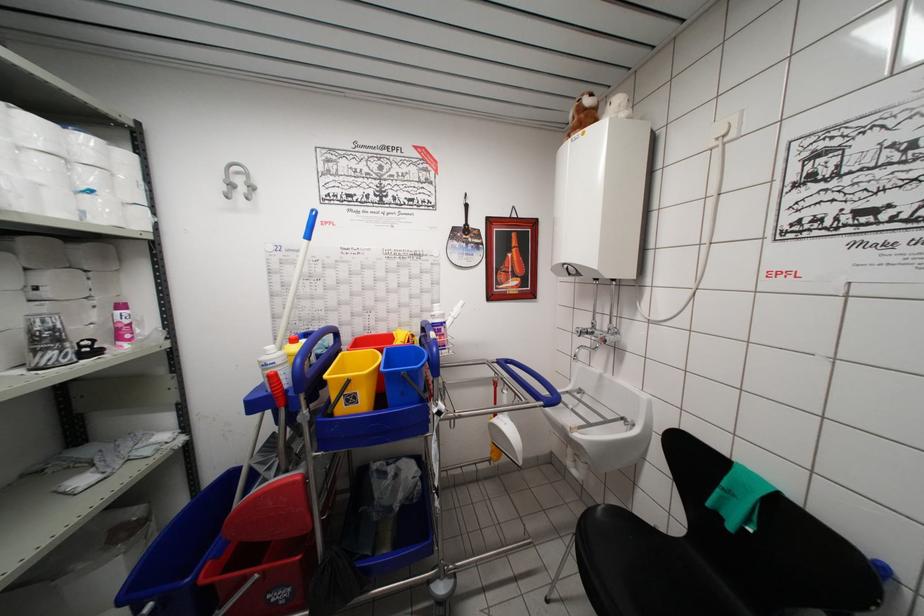
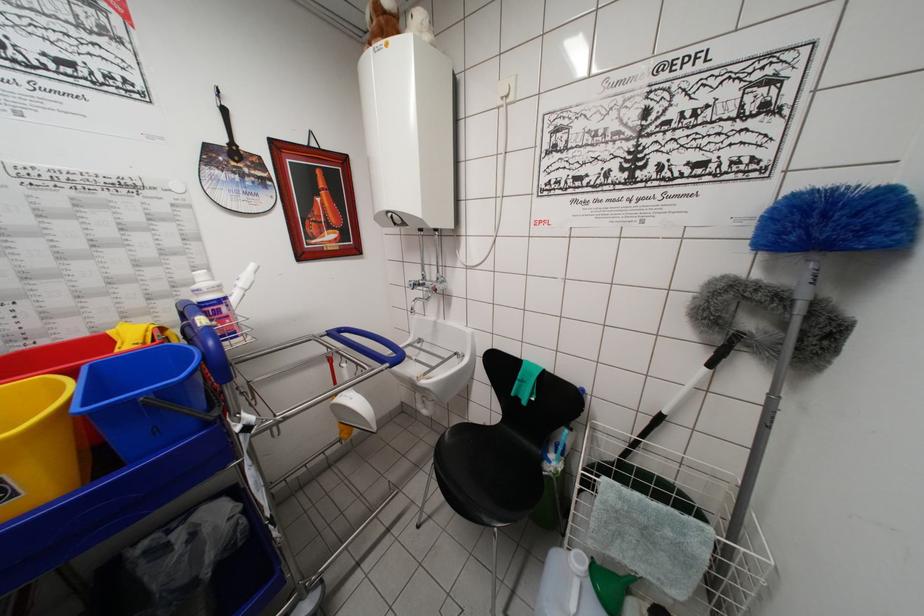
Find the pixel in the second image that matches the point at 613,342 in the first image.

(443, 292)